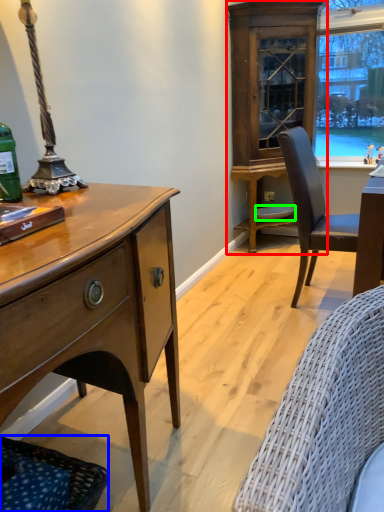
Question: Estimate the real-world distances between objects in this image. Which object is closer to cabinetry (highlighted by a red box), studio couch (highlighted by a blue box) or plate (highlighted by a green box)?

Choices:
 (A) studio couch
 (B) plate

Answer: (B)